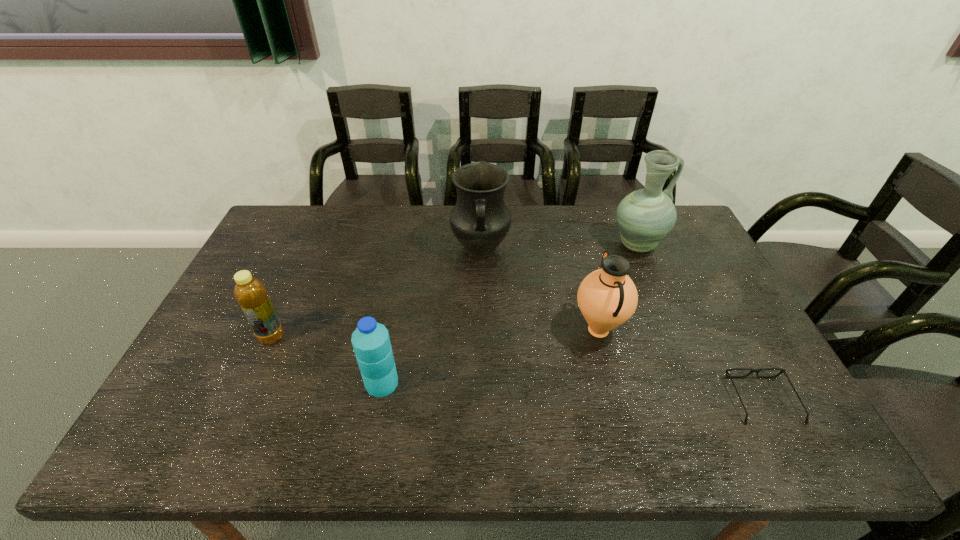
I want to click on vacant area between the fourth object from right to left and the fourth object from left to right, so click(540, 290).

Locate an element on the screen. Image resolution: width=960 pixels, height=540 pixels. free space that is in between the spectacles and the fifth object from right to left is located at coordinates (572, 392).

In order to click on empty space between the leftmost object and the water bottle in this screenshot , I will do `click(326, 360)`.

The width and height of the screenshot is (960, 540). Identify the location of blank region between the bottle and the fifth object from right to left. (326, 360).

Locate an element on the screen. free space between the third object from right to left and the water bottle is located at coordinates (490, 356).

Identify which object is located as the fourth nearest to the tallest pitcher. Please provide its 2D coordinates. Your answer should be formatted as a tuple, i.e. [(x, y)], where the tuple contains the x and y coordinates of a point satisfying the conditions above.

[(371, 342)]

Find the location of a particular element. The width and height of the screenshot is (960, 540). object that is the third nearest to the leftmost object is located at coordinates click(607, 297).

Where is `pitcher that stands as the closest to the fourth object from right to left`? pitcher that stands as the closest to the fourth object from right to left is located at coordinates (607, 297).

I want to click on pitcher that is the nearest to the leftmost pitcher, so click(x=607, y=297).

What are the coordinates of `free space in the image that satisfies the following two spatial constraints: 1. on the handle side of the tallest object; 2. on the front side of the leftmost object` in the screenshot? It's located at (675, 337).